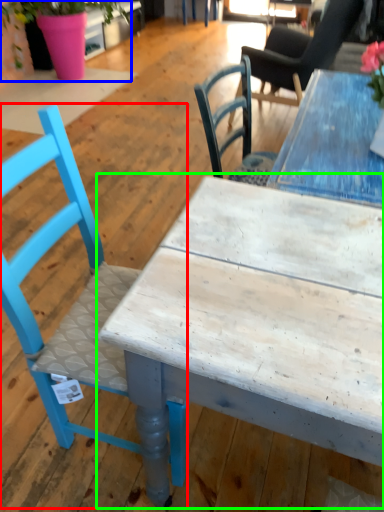
Question: Which object is the closest to the chair (highlighted by a red box)? Choose among these: houseplant (highlighted by a blue box) or table (highlighted by a green box).

Choices:
 (A) houseplant
 (B) table

Answer: (B)